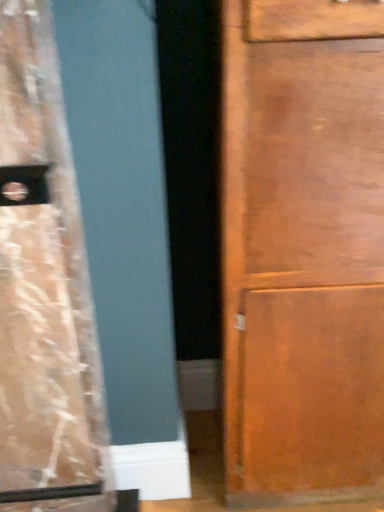
This screenshot has width=384, height=512. Describe the element at coordinates (303, 250) in the screenshot. I see `wooden door at right` at that location.

At what (x,y) coordinates should I click in order to perform the action: click on wooden door at right. Please return your answer as a coordinate pair (x, y). Looking at the image, I should click on (303, 250).

What is the approximate width of wooden door at right?

wooden door at right is 17.72 inches in width.

Where is `wooden door at right`? The height and width of the screenshot is (512, 384). wooden door at right is located at coordinates (303, 250).